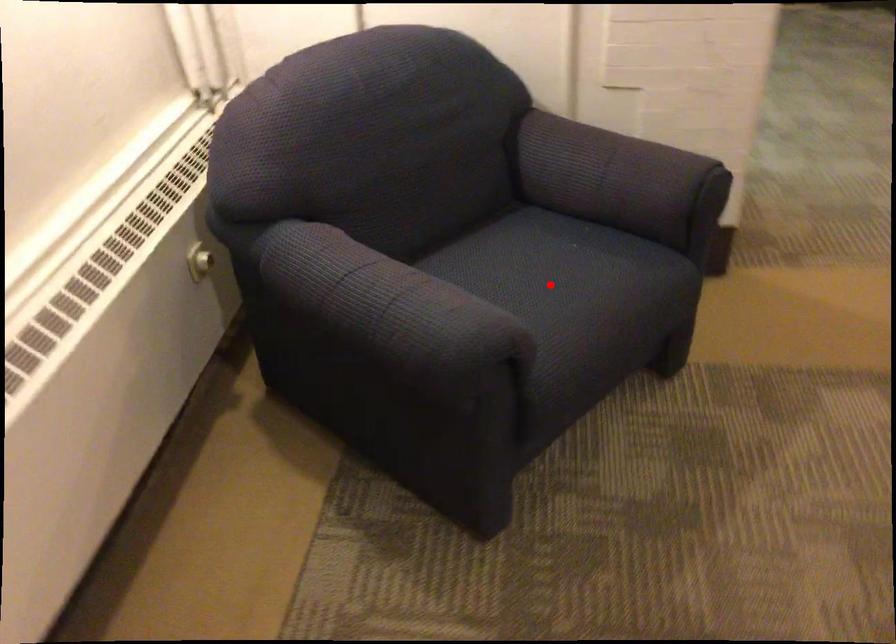
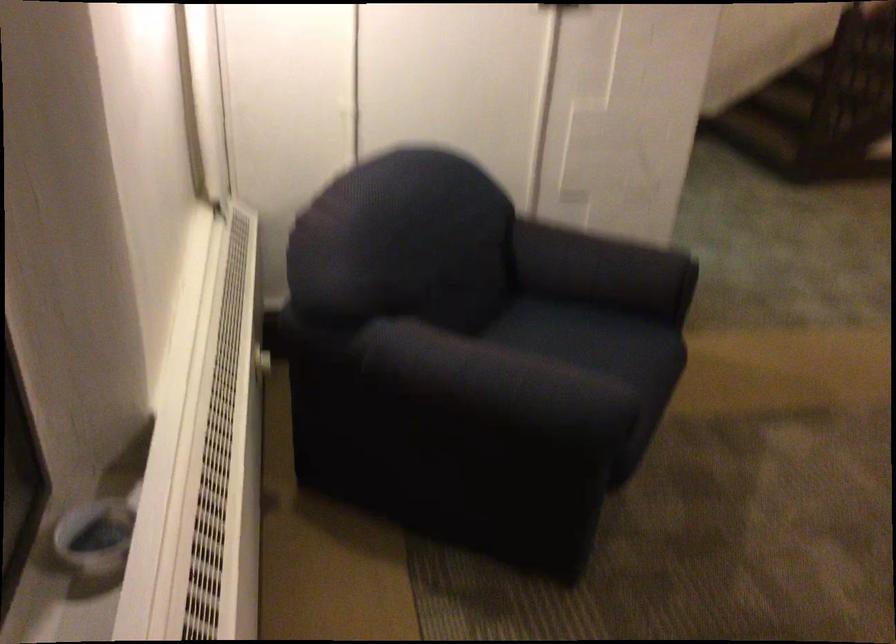
In the second image, find the point that corresponds to the highlighted location in the first image.

(601, 355)